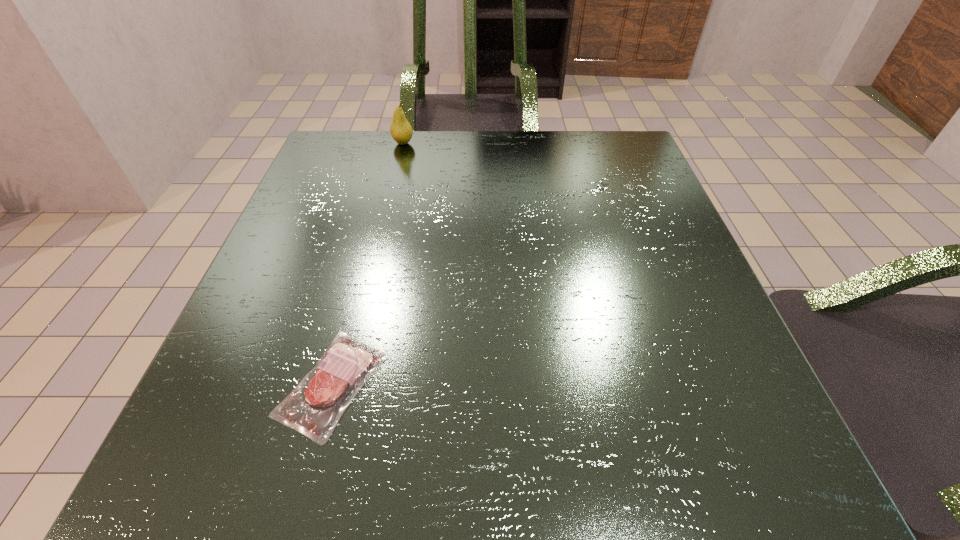
Where is `object that is at the far left corner`? The width and height of the screenshot is (960, 540). object that is at the far left corner is located at coordinates (401, 131).

Locate an element on the screen. object that is at the near left corner is located at coordinates (314, 409).

This screenshot has width=960, height=540. What are the coordinates of `free space at the far edge of the desktop` in the screenshot? It's located at (419, 170).

Where is `vacant space at the left edge of the desktop`? vacant space at the left edge of the desktop is located at coordinates (280, 393).

This screenshot has height=540, width=960. I want to click on blank space at the right edge, so (x=672, y=292).

Identify the location of free space at the far left corner. (334, 161).

Identify the location of vacant space at the far right corner. This screenshot has height=540, width=960. (626, 142).

At what (x,y) coordinates should I click in order to perform the action: click on blank area at the near right corner. Please return your answer as a coordinate pair (x, y). Image resolution: width=960 pixels, height=540 pixels. Looking at the image, I should click on (669, 480).

Locate an element on the screen. free location that satisfies the following two spatial constraints: 1. on the back side of the taller object; 2. on the left side of the shorter object is located at coordinates (396, 143).

Locate an element on the screen. This screenshot has height=540, width=960. vacant region that satisfies the following two spatial constraints: 1. on the back side of the steak; 2. on the right side of the taller object is located at coordinates [x=396, y=143].